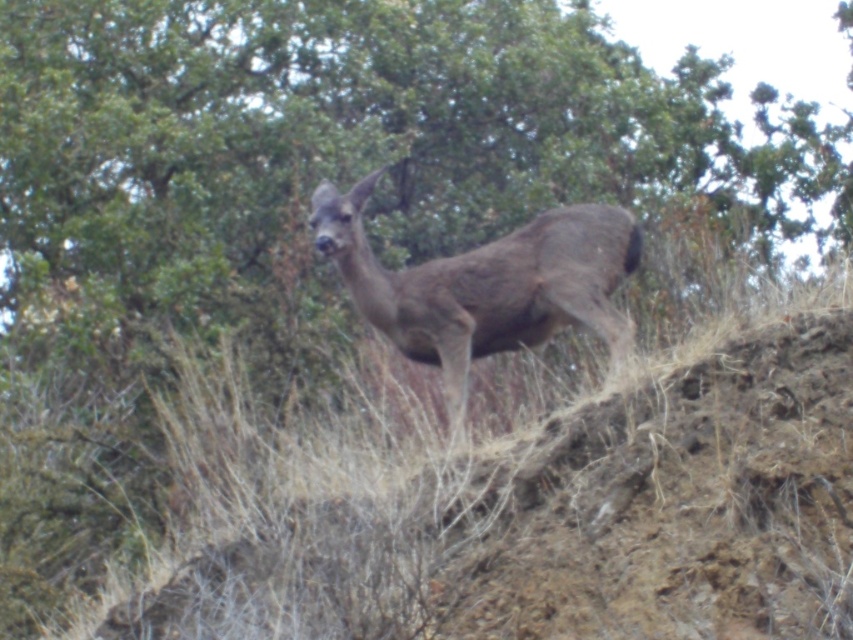
You are a photographer trying to capture a clear shot of the brown fur deer at center. The green leafy tree at upper center is blocking your view. Can you determine if the tree is bigger than the deer?

The green leafy tree at upper center is larger in size than brown fur deer at center, so yes, the tree is bigger than the deer and might be blocking your view.

You are a hiker lost in the woods. You see a deer on the grassy terrain and notice a point marked at coordinates (341, 160). What is located at that point?

The point at coordinates (341, 160) indicates a green leafy tree at upper center.